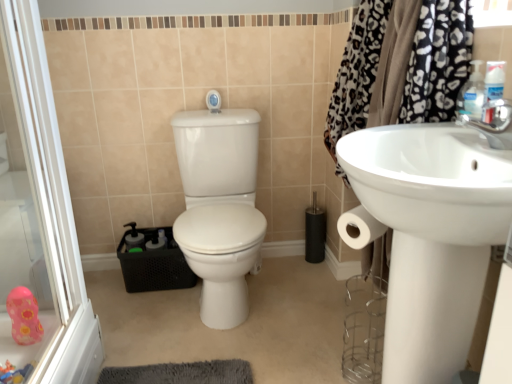
Question: Based on their sizes in the image, would you say pink rubber duck at lower left, which is the 1th toy from back to front, is bigger or smaller than pink rubber duck at lower left?

Choices:
 (A) small
 (B) big

Answer: (A)

Question: Is pink rubber duck at lower left, the second toy when ordered from front to back, in front of or behind pink rubber duck at lower left in the image?

Choices:
 (A) behind
 (B) front

Answer: (A)

Question: Estimate the real-world distances between objects in this image. Which object is closer to the white glossy toilet at center?

Choices:
 (A) white glossy shower at upper center
 (B) pink rubber duck at lower left, the second toy when ordered from front to back
 (C) white glossy sink at right
 (D) plastic pink toy at lower left, placed as the first toy when sorted from bottom to top
 (E) pink rubber duck at lower left

Answer: (E)

Question: Considering the real-world distances, which object is closest to the plastic pink toy at lower left, placed as the first toy when sorted from bottom to top?

Choices:
 (A) black leopard print fabric at upper right
 (B) pink rubber duck at lower left
 (C) pink rubber duck at lower left, the first toy viewed from the top
 (D) white glossy toilet at center
 (E) white glossy sink at right

Answer: (C)